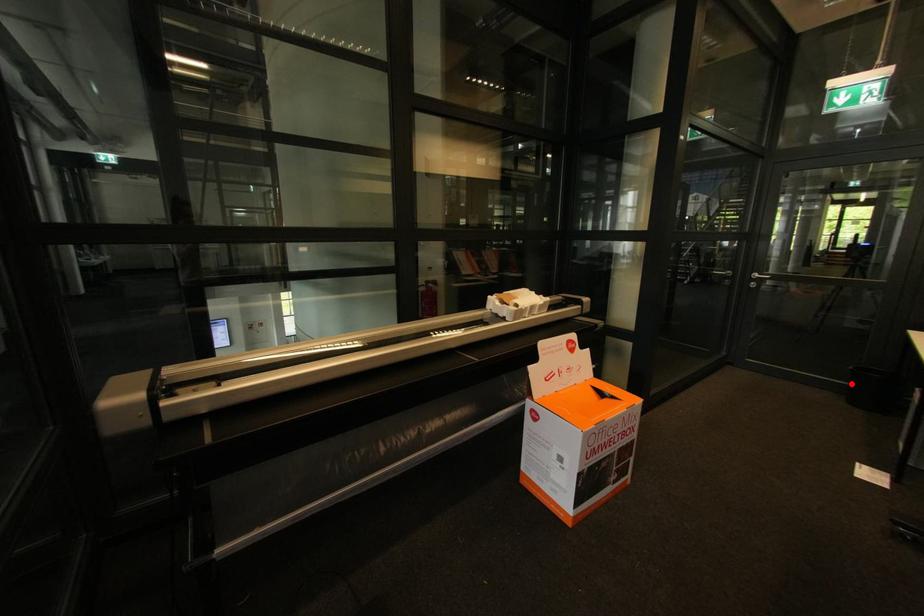
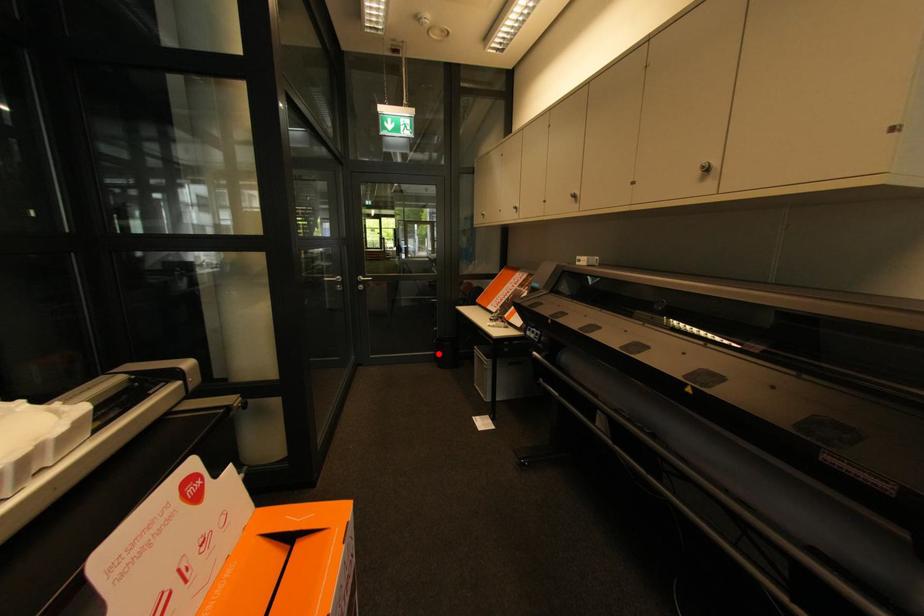
I am providing you with two images of the same scene from different viewpoints. A red point is marked on the first image and another point is marked on the second image. Does the point marked in image1 correspond to the same location as the one in image2?

Yes